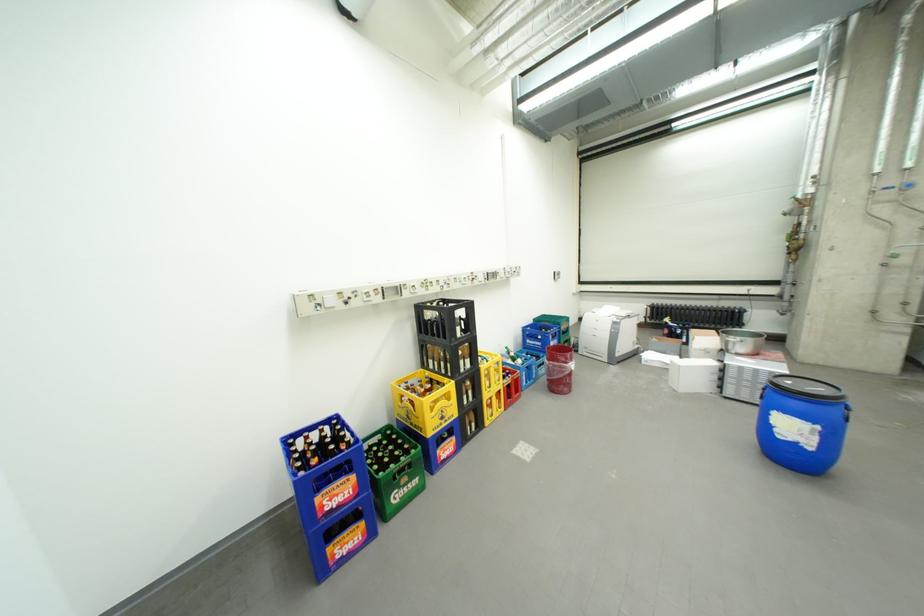
Find where to lift the blue barrel handle. Please return your answer as a coordinate pair (x, y).

(761, 390)